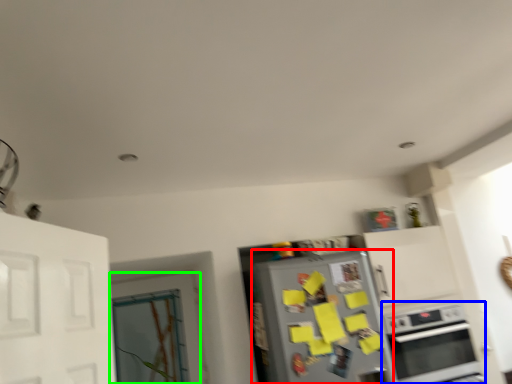
Question: Which is nearer to the refrigerator (highlighted by a red box)? oven (highlighted by a blue box) or door (highlighted by a green box).

Choices:
 (A) oven
 (B) door

Answer: (A)